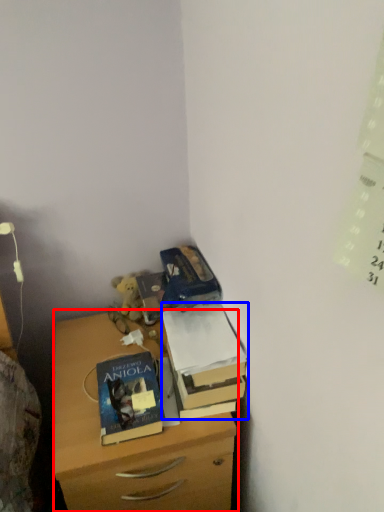
Question: Which of the following is the farthest to the observer, chest of drawers (highlighted by a red box) or box (highlighted by a blue box)?

Choices:
 (A) chest of drawers
 (B) box

Answer: (B)